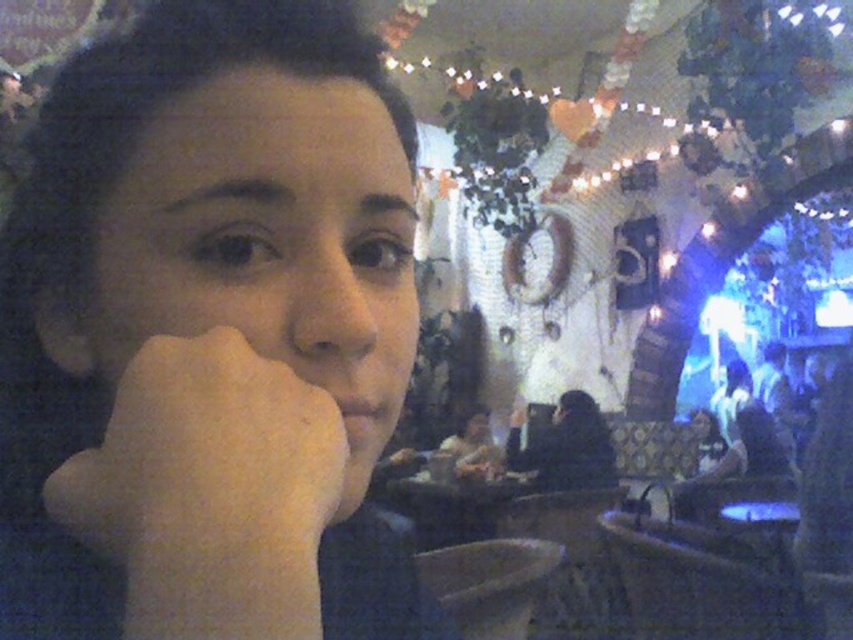
You are a photographer adjusting the lighting for a portrait. You notice the smooth skin at center and the black matte jacket at center in your frame. Which object should you focus on to ensure proper exposure, considering their size and reflectivity?

The smooth skin at center should be focused on for proper exposure because it is smaller and more reflective than the black matte jacket at center.